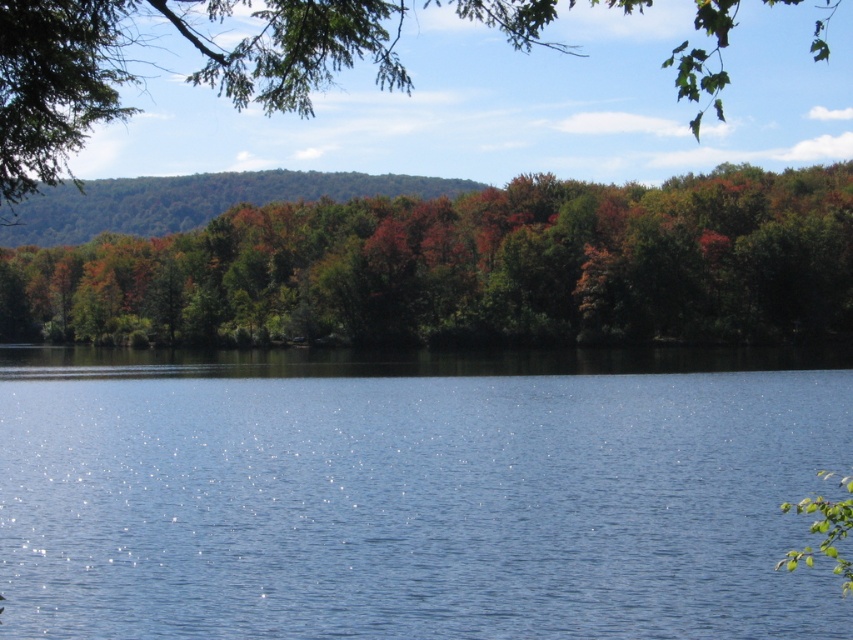
Which of these two, green leafy trees at center or green matte tree at upper center, stands shorter?

green leafy trees at center

Identify the location of green leafy trees at center. (468, 268).

Between blue liquid water at center and green matte tree at upper center, which one is positioned lower?

blue liquid water at center

Looking at this image, is blue liquid water at center further to camera compared to green matte tree at upper center?

Yes, it is behind green matte tree at upper center.

Is point (494, 552) positioned after point (402, 92)?

No, (494, 552) is in front of (402, 92).

You are a GUI agent. You are given a task and a screenshot of the screen. Output one action in this format:
    pyautogui.click(x=<x>, y=<y>)
    Task: Click on the blue liquid water at center
    
    Given the screenshot: What is the action you would take?
    pyautogui.click(x=416, y=492)

Can you confirm if blue liquid water at center is positioned above green leafy trees at center?

No.

Can you confirm if blue liquid water at center is positioned to the left of green leafy trees at center?

Incorrect, blue liquid water at center is not on the left side of green leafy trees at center.

Locate an element on the screen. The height and width of the screenshot is (640, 853). blue liquid water at center is located at coordinates (416, 492).

Image resolution: width=853 pixels, height=640 pixels. What are the coordinates of `blue liquid water at center` in the screenshot? It's located at (416, 492).